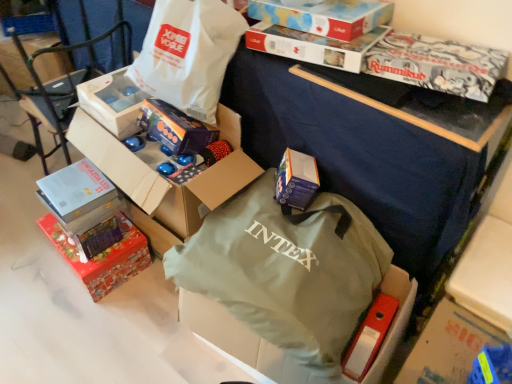
Question: From the image's perspective, is blue cardboard box at center, the second box in the bottom-to-top sequence, located beneath matte purple gift box at center?

Choices:
 (A) yes
 (B) no

Answer: (A)

Question: Is the position of blue cardboard box at center, the second box in the bottom-to-top sequence, more distant than that of matte purple gift box at center?

Choices:
 (A) no
 (B) yes

Answer: (A)

Question: Is blue cardboard box at center, which ranks as the fourth box in top-to-bottom order, smaller than matte purple gift box at center?

Choices:
 (A) no
 (B) yes

Answer: (A)

Question: Can you confirm if blue cardboard box at center, the second box in the bottom-to-top sequence, is taller than matte purple gift box at center?

Choices:
 (A) no
 (B) yes

Answer: (B)

Question: Could matte purple gift box at center be considered to be inside blue cardboard box at center, the second box in the bottom-to-top sequence?

Choices:
 (A) no
 (B) yes

Answer: (A)

Question: From the image's perspective, is blue cardboard box at center, which ranks as the fourth box in top-to-bottom order, above or below white matte box at upper left, acting as the third box starting from the bottom?

Choices:
 (A) below
 (B) above

Answer: (A)

Question: Is point (316, 182) positioned closer to the camera than point (86, 82)?

Choices:
 (A) closer
 (B) farther

Answer: (A)

Question: From a real-world perspective, is blue cardboard box at center, which ranks as the fourth box in top-to-bottom order, physically located above or below white matte box at upper left, acting as the third box starting from the bottom?

Choices:
 (A) below
 (B) above

Answer: (A)

Question: In the image, is blue cardboard box at center, which ranks as the fourth box in top-to-bottom order, positioned in front of or behind white matte box at upper left, the third box positioned from the top?

Choices:
 (A) front
 (B) behind

Answer: (A)

Question: From the image's perspective, is matte cardboard box at left located above or below green fabric bag at center, the second bag from the top?

Choices:
 (A) above
 (B) below

Answer: (A)

Question: Is matte cardboard box at left bigger or smaller than green fabric bag at center, the second bag from the top?

Choices:
 (A) big
 (B) small

Answer: (A)

Question: From their relative heights in the image, would you say matte cardboard box at left is taller or shorter than green fabric bag at center, acting as the first bag starting from the bottom?

Choices:
 (A) short
 (B) tall

Answer: (B)

Question: Considering the relative positions of matte cardboard box at left and green fabric bag at center, acting as the first bag starting from the bottom, in the image provided, is matte cardboard box at left to the left or to the right of green fabric bag at center, acting as the first bag starting from the bottom,?

Choices:
 (A) right
 (B) left

Answer: (B)

Question: In terms of height, does red glossy gift box at lower left, the first box when ordered from bottom to top, look taller or shorter compared to white paper bag at upper center, marked as the second bag in a bottom-to-top arrangement?

Choices:
 (A) short
 (B) tall

Answer: (A)

Question: Based on their positions, is red glossy gift box at lower left, the first box when ordered from bottom to top, located to the left or right of white paper bag at upper center, marked as the second bag in a bottom-to-top arrangement?

Choices:
 (A) left
 (B) right

Answer: (A)